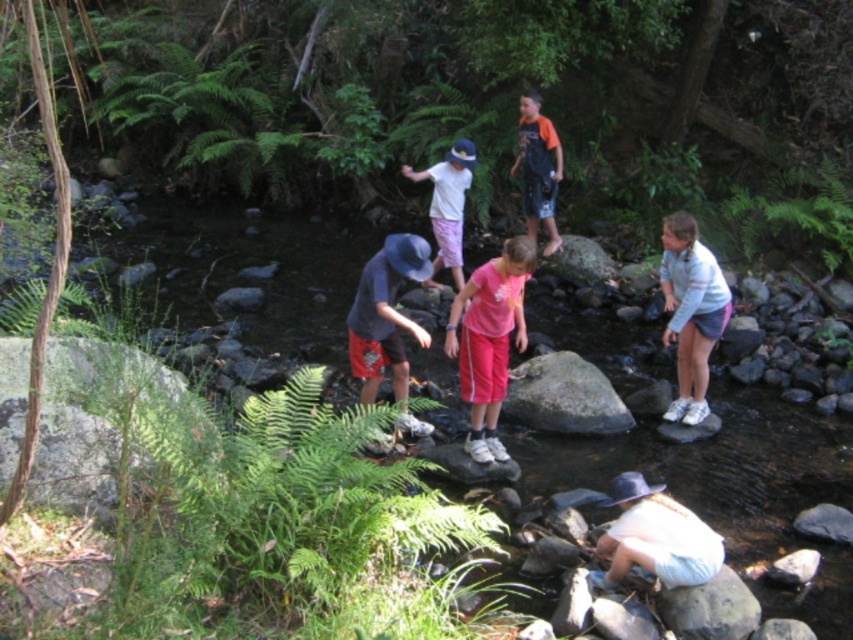
Between smooth rock creek at center and green leafy fern at upper right, which one is positioned lower?

smooth rock creek at center is below.

Is smooth rock creek at center taller than green leafy fern at upper right?

Correct, smooth rock creek at center is much taller as green leafy fern at upper right.

Identify the location of smooth rock creek at center. (730, 484).

You are a GUI agent. You are given a task and a screenshot of the screen. Output one action in this format:
    pyautogui.click(x=<x>, y=<y>)
    Task: Click on the smooth rock creek at center
    
    Given the screenshot: What is the action you would take?
    point(730,484)

Does smooth rock creek at center have a lesser height compared to gray smooth rock at center?

Incorrect, smooth rock creek at center's height does not fall short of gray smooth rock at center's.

Is smooth rock creek at center below gray smooth rock at center?

No.

Locate an element on the screen. smooth rock creek at center is located at coordinates (730, 484).

Is smooth rock creek at center to the left of white cotton shirt at center from the viewer's perspective?

Indeed, smooth rock creek at center is positioned on the left side of white cotton shirt at center.

Is smooth rock creek at center positioned before white cotton shirt at center?

Yes, smooth rock creek at center is in front of white cotton shirt at center.

Measure the distance between smooth rock creek at center and camera.

smooth rock creek at center and camera are 3.93 meters apart.

I want to click on smooth rock creek at center, so click(730, 484).